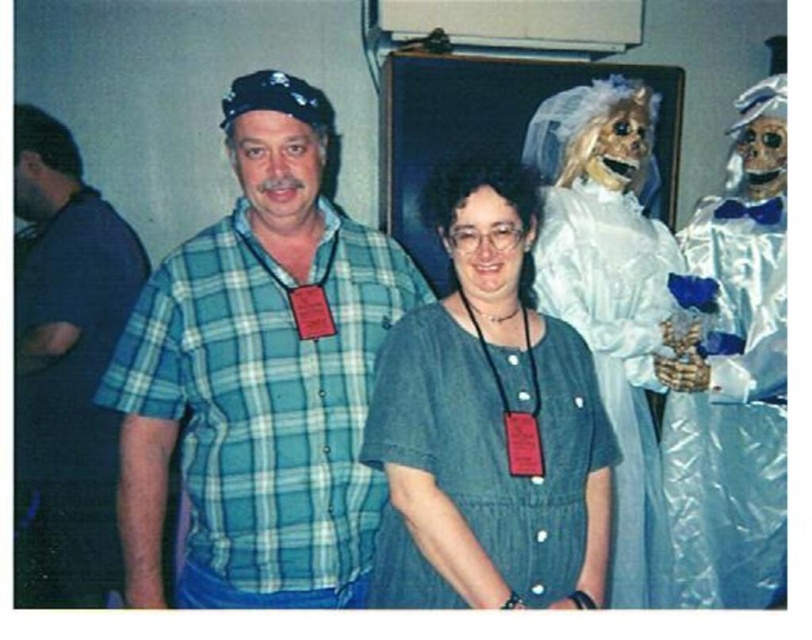
You are at a social event and see a green plaid shirt at center. Can you confirm if the green plaid shirt at center is located exactly at the point with coordinates (x=260, y=376)?

Yes, the green plaid shirt at center is located exactly at point (x=260, y=376).

You are at a social event and need to find the person wearing the green plaid shirt at center. Since you are looking from the entrance, which direction should you look relative to the white satin dress at right?

The green plaid shirt at center has a lesser height compared to the white satin dress at right, so you should look downward relative to the white satin dress at right to find the green plaid shirt at center.

You are standing in the room and see the green plaid shirt at center. Can you determine if the green plaid shirt at center is located to the left or right of the point marked at coordinates (x=260, y=376)?

The green plaid shirt at center is represented by point (x=260, y=376), so it is exactly at that location.